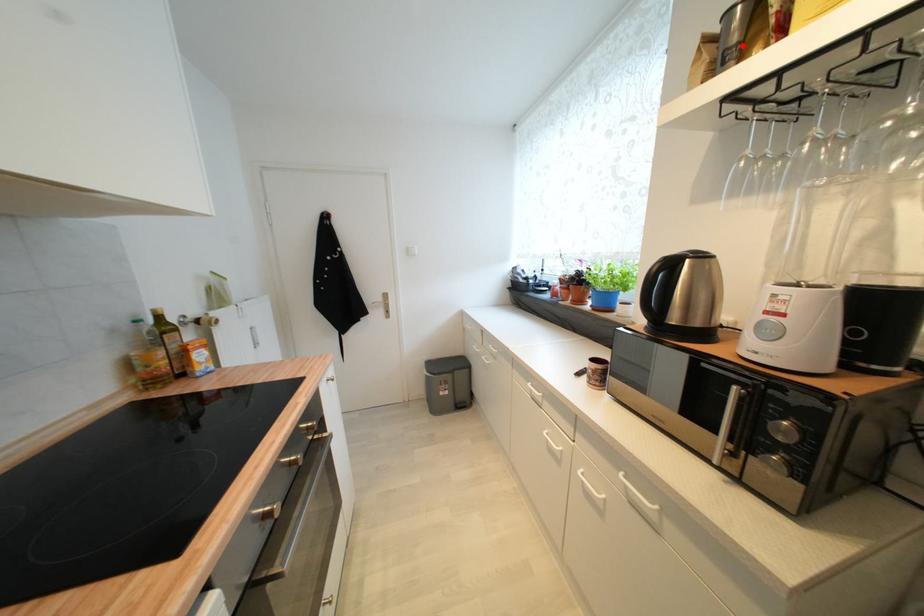
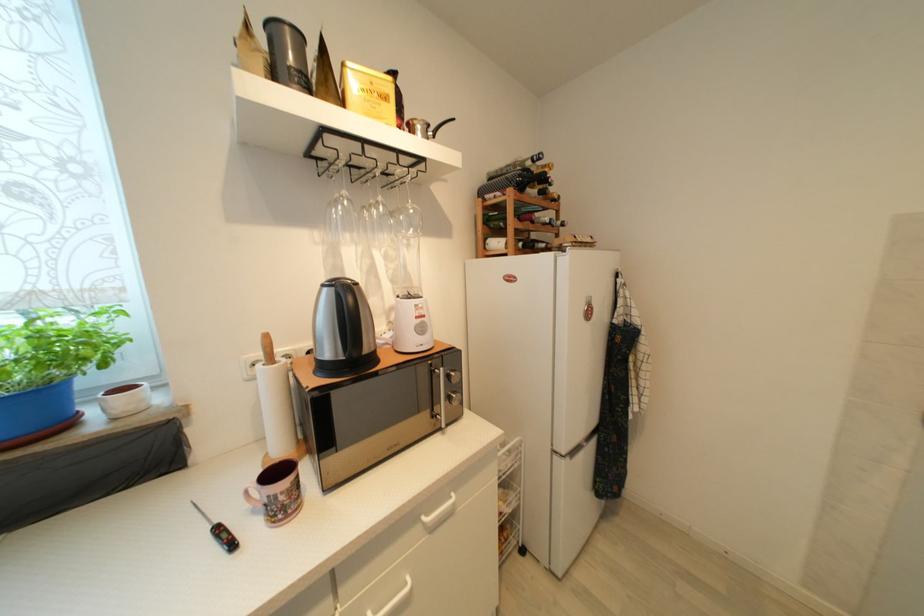
Find the pixel in the second image that matches the highlighted location in the first image.

(305, 74)